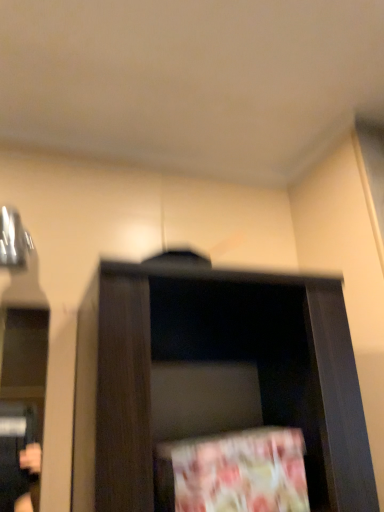
This screenshot has width=384, height=512. Find the location of `floral fabric curtain at lower center`. floral fabric curtain at lower center is located at coordinates (238, 472).

What do you see at coordinates (238, 472) in the screenshot? This screenshot has height=512, width=384. I see `floral fabric curtain at lower center` at bounding box center [238, 472].

Locate an element on the screen. floral fabric curtain at lower center is located at coordinates (238, 472).